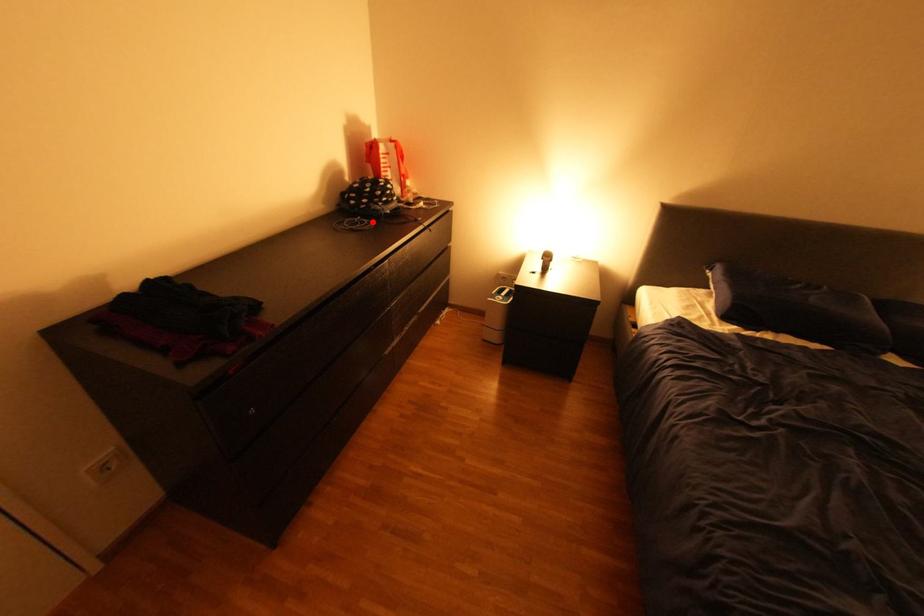
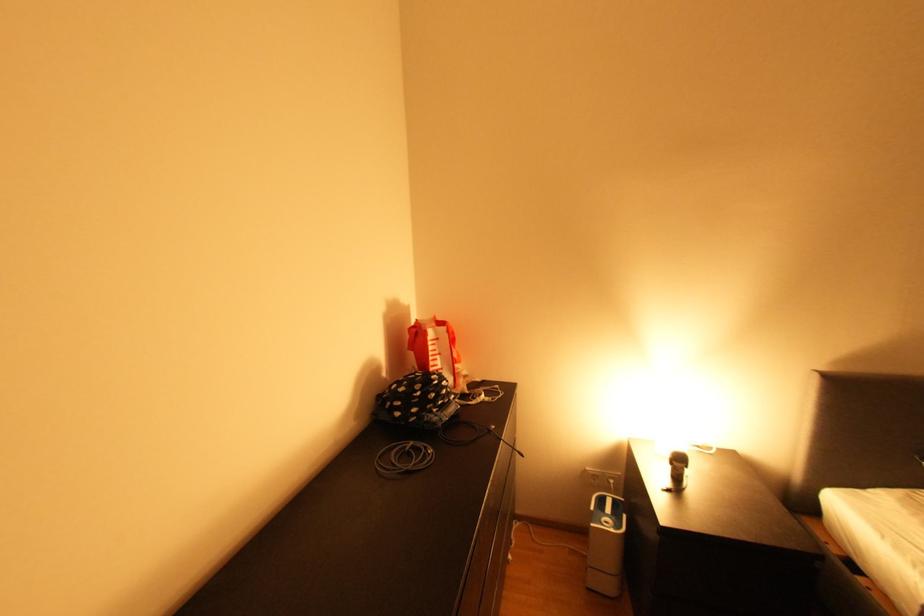
The point at the highlighted location is marked in the first image. Where is the corresponding point in the second image?

(428, 450)